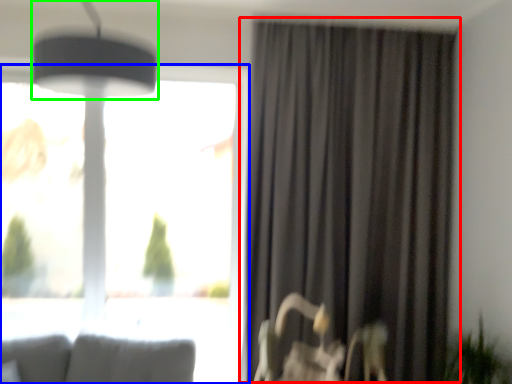
Question: Which object is positioned farthest from curtain (highlighted by a red box)? Select from window (highlighted by a blue box) and lamp (highlighted by a green box).

Choices:
 (A) window
 (B) lamp

Answer: (B)